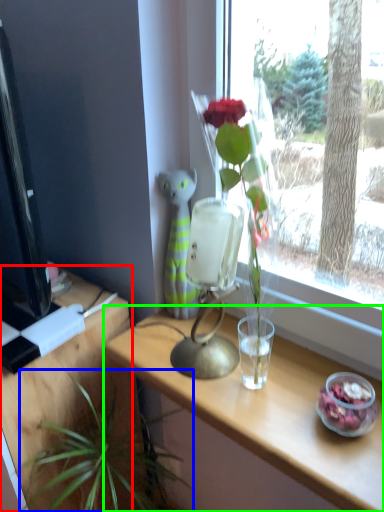
Question: Considering the real-world distances, which object is closest to table (highlighted by a red box)? houseplant (highlighted by a blue box) or table (highlighted by a green box).

Choices:
 (A) houseplant
 (B) table

Answer: (A)